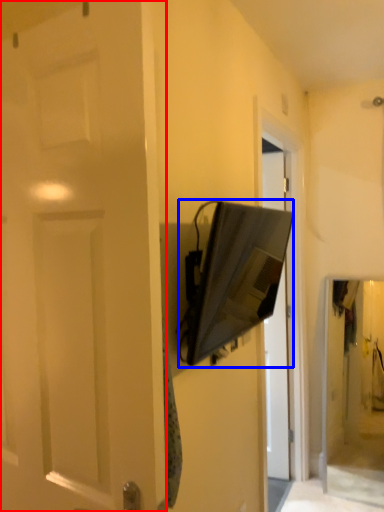
Question: Which of the following is the farthest to the observer, door (highlighted by a red box) or medicine cabinet (highlighted by a blue box)?

Choices:
 (A) door
 (B) medicine cabinet

Answer: (B)